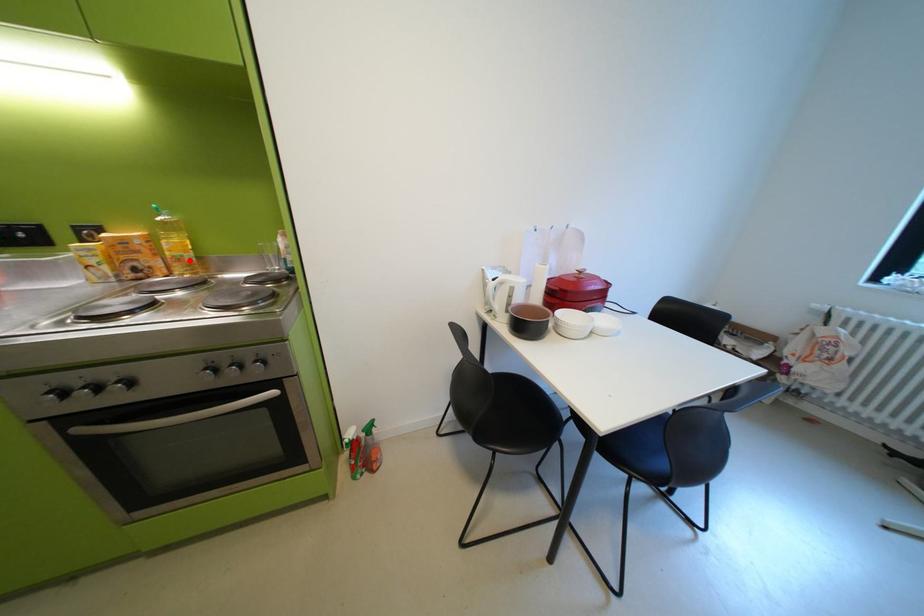
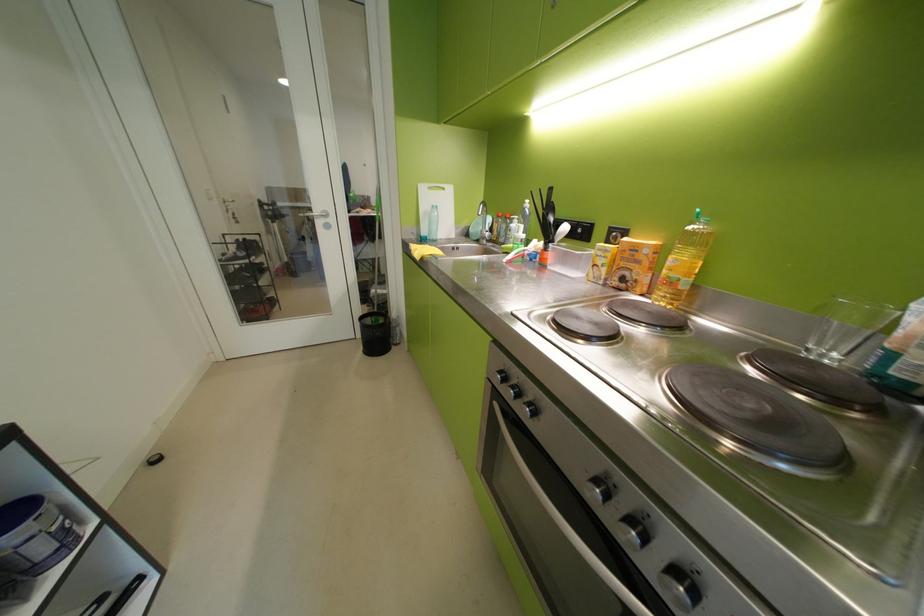
Find the pixel in the second image that matches the highlighted location in the first image.

(681, 284)